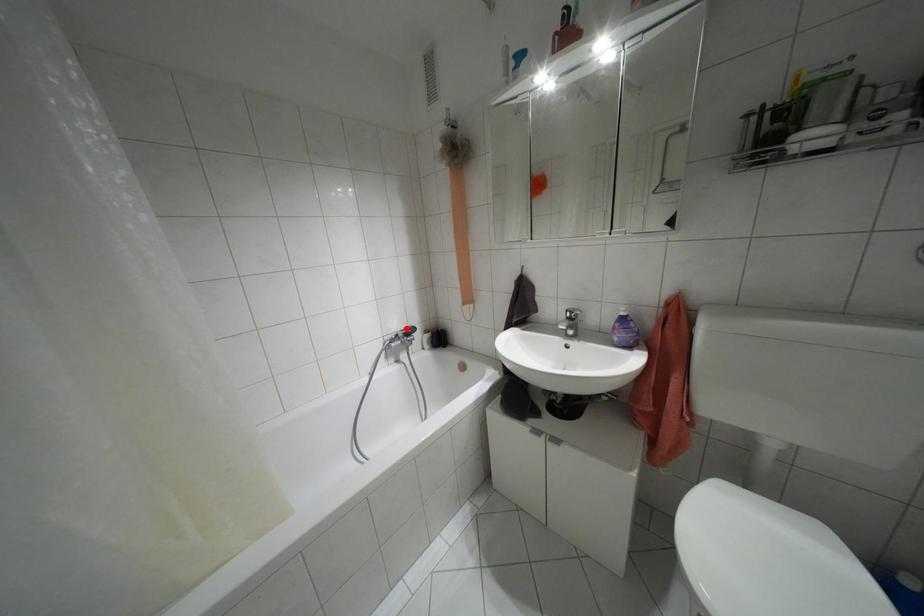
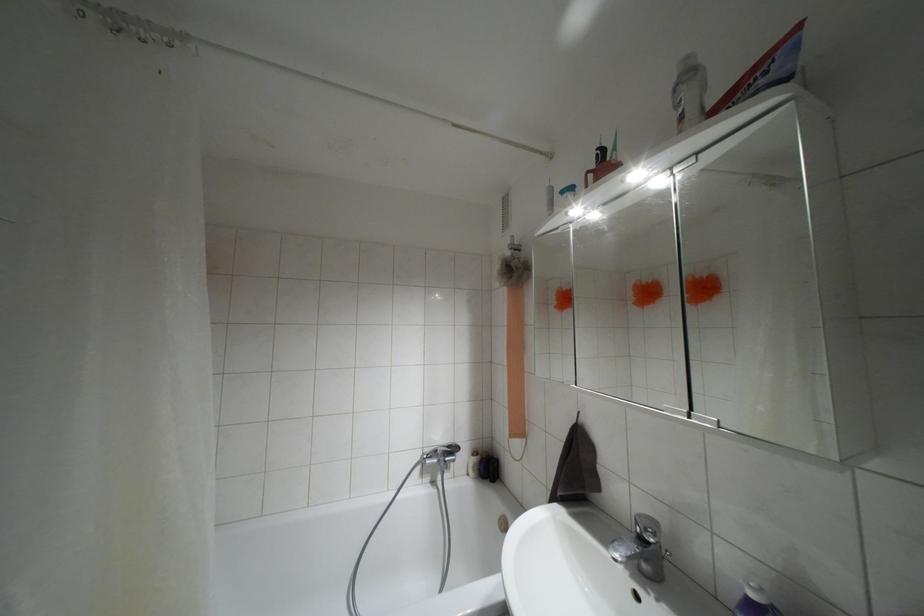
Question: A red point is marked in image1. In image2, is the corresponding 3D point closer to the camera or farther? Reply with the corresponding letter.

Choices:
 (A) The corresponding 3D point is closer.
 (B) The corresponding 3D point is farther.

Answer: (B)